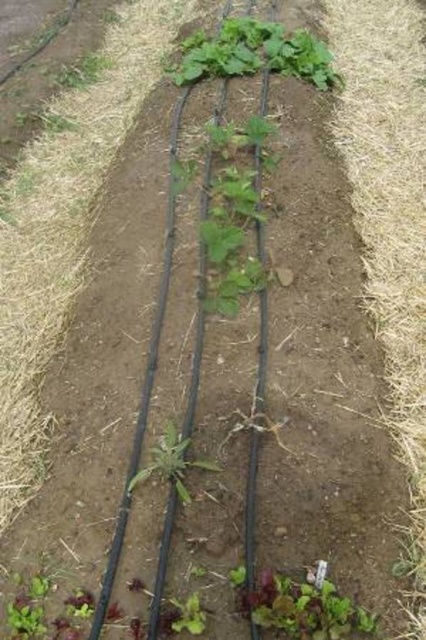
Measure the distance from brown straw at right to green leafy lettuce at lower center.

32.84 inches

Does point (389, 298) lie behind point (302, 632)?

Yes.

Image resolution: width=426 pixels, height=640 pixels. What are the coordinates of `brown straw at right` in the screenshot? It's located at (389, 211).

Is the position of green leafy plant at upper center less distant than that of green leafy at center?

That is False.

Does green leafy plant at upper center have a smaller size compared to green leafy at center?

Incorrect, green leafy plant at upper center is not smaller in size than green leafy at center.

Which is in front, point (273, 33) or point (192, 611)?

Point (192, 611) is more forward.

Identify the location of green leafy plant at upper center. (255, 52).

Is point (308, 36) in front of point (347, 627)?

No, it is behind (347, 627).

Does green leafy plant at upper center appear under green leafy lettuce at lower center?

No, green leafy plant at upper center is not below green leafy lettuce at lower center.

Is point (198, 38) farther from camera compared to point (365, 620)?

That is True.

Where is `green leafy plant at upper center`? This screenshot has width=426, height=640. green leafy plant at upper center is located at coordinates (255, 52).